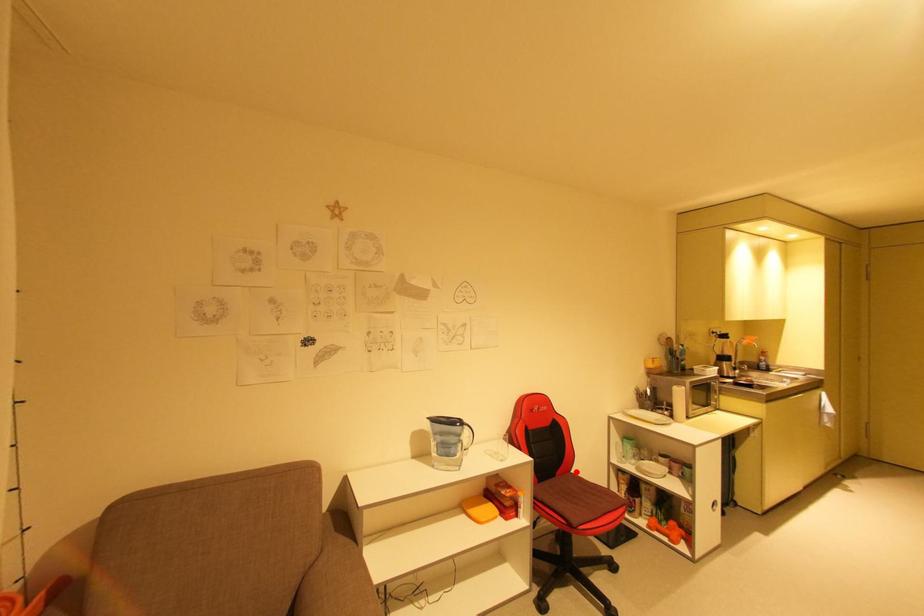
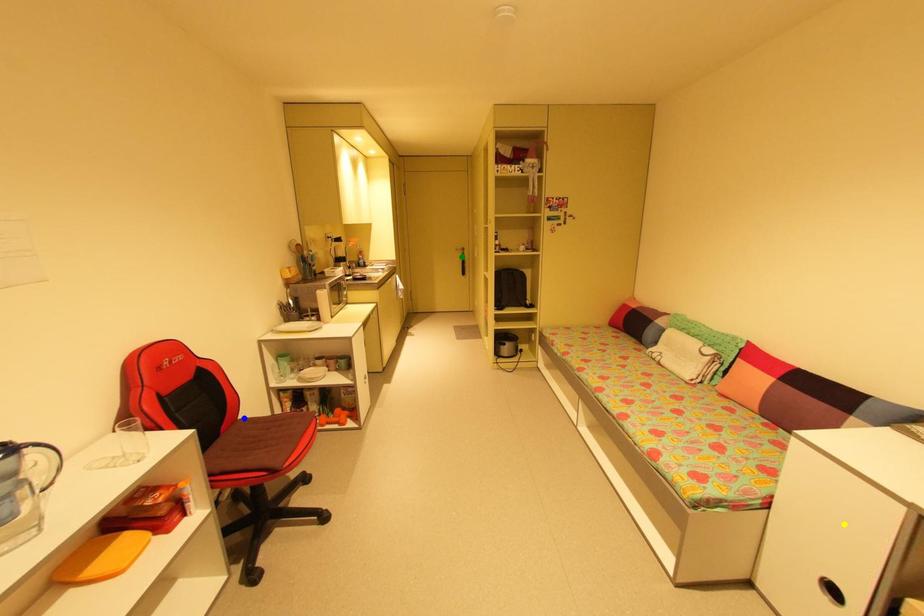
Question: I am providing you with two images of the same scene from different viewpoints. A red point is marked on the first image. You are given multiple points on the second image. Which point in image 2 is actually the same real-world point as the red point in image 1?

Choices:
 (A) yellow point
 (B) blue point
 (C) green point

Answer: (B)